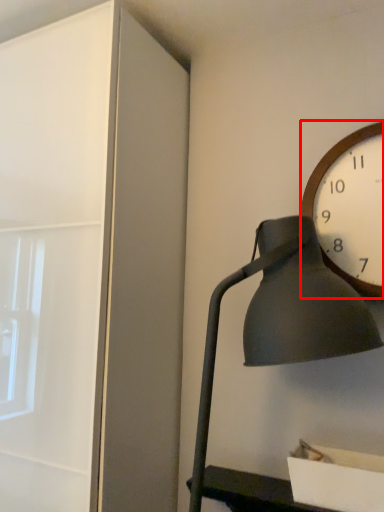
Question: From the image's perspective, what is the correct spatial positioning of wall clock (annotated by the red box) in reference to lamp?

Choices:
 (A) below
 (B) above

Answer: (B)